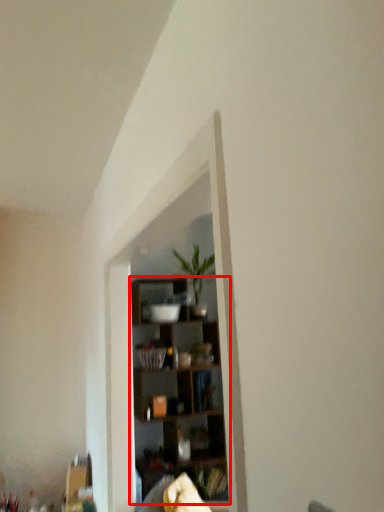
Question: From the image's perspective, what is the correct spatial relationship of shelf (annotated by the red box) in relation to houseplant?

Choices:
 (A) above
 (B) below

Answer: (B)